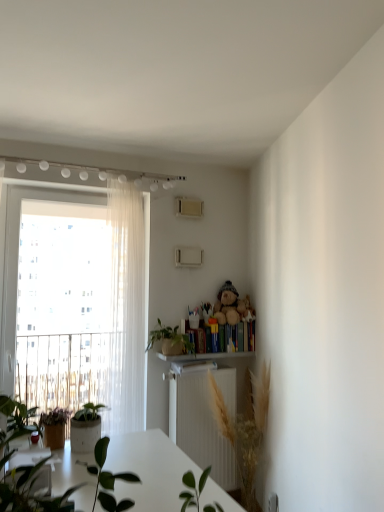
Question: Looking at the image, does hardcover books at right seem bigger or smaller compared to sheer white curtain at left?

Choices:
 (A) small
 (B) big

Answer: (A)

Question: Is hardcover books at right spatially inside sheer white curtain at left, or outside of it?

Choices:
 (A) inside
 (B) outside

Answer: (B)

Question: Which of these objects is positioned farthest from the green leafy plant at center, the 2th houseplant viewed from the top?

Choices:
 (A) hardcover books at right
 (B) green matte plant at center, the 2th houseplant from the bottom
 (C) fuzzy brown teddy bear at upper center
 (D) sheer white curtain at left
 (E) transparent glass window at left

Answer: (E)

Question: Which object is positioned closest to the sheer white curtain at left?

Choices:
 (A) green leafy plant at center, the 2th houseplant viewed from the top
 (B) green matte plant at center, which is the 1th houseplant in top-to-bottom order
 (C) white wooden shelf at center
 (D) hardcover books at right
 (E) fuzzy brown teddy bear at upper center

Answer: (B)